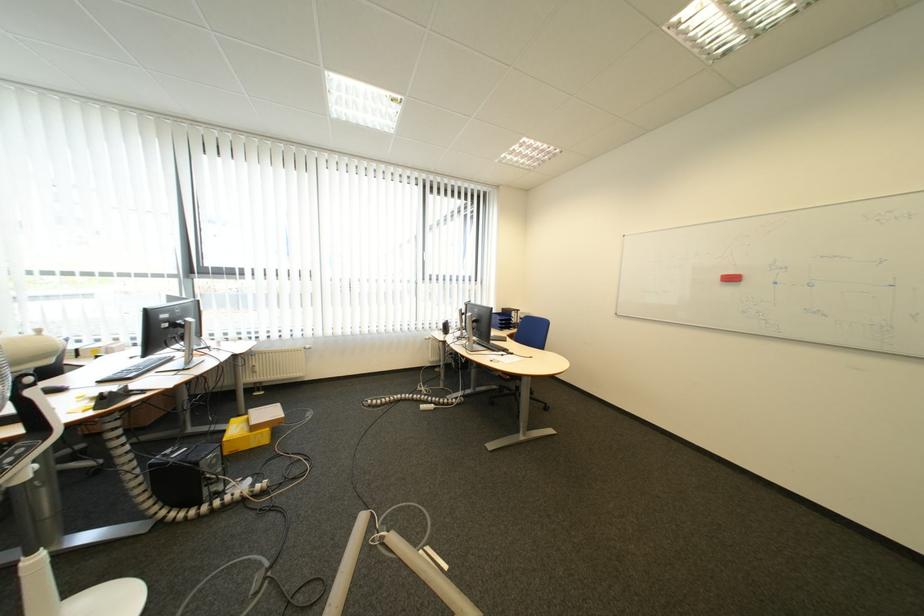
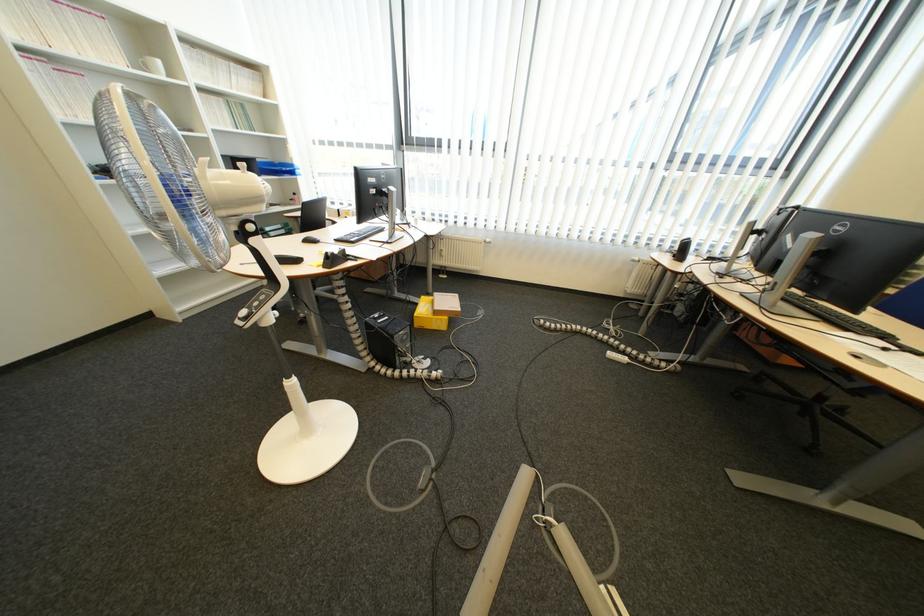
Where in the second image is the point corresponding to pixel 264 411 from the first image?

(448, 294)